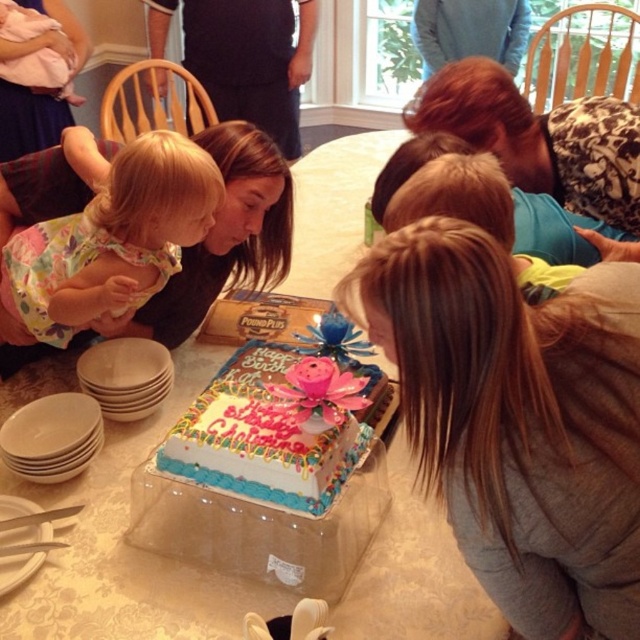
Does floral dress at left have a smaller size compared to leopard print shirt at center?

Actually, floral dress at left might be larger than leopard print shirt at center.

Which of these two, floral dress at left or leopard print shirt at center, stands taller?

floral dress at left is taller.

This screenshot has height=640, width=640. Describe the element at coordinates (112, 241) in the screenshot. I see `floral dress at left` at that location.

You are a GUI agent. You are given a task and a screenshot of the screen. Output one action in this format:
    pyautogui.click(x=<x>, y=<y>)
    Task: Click on the floral dress at left
    
    Given the screenshot: What is the action you would take?
    pyautogui.click(x=112, y=241)

Does brown textured sweater at center appear over floral dress at left?

Incorrect, brown textured sweater at center is not positioned above floral dress at left.

Looking at this image, who is more forward, (516,596) or (22,266)?

Positioned in front is point (516,596).

Where is `brown textured sweater at center`? Image resolution: width=640 pixels, height=640 pixels. brown textured sweater at center is located at coordinates click(518, 419).

Can you confirm if brown textured sweater at center is positioned to the left of leopard print shirt at center?

Yes, brown textured sweater at center is to the left of leopard print shirt at center.

Who is positioned more to the right, brown textured sweater at center or leopard print shirt at center?

Positioned to the right is leopard print shirt at center.

You are a GUI agent. You are given a task and a screenshot of the screen. Output one action in this format:
    pyautogui.click(x=<x>, y=<y>)
    Task: Click on the brown textured sweater at center
    The image size is (640, 640).
    Given the screenshot: What is the action you would take?
    pyautogui.click(x=518, y=419)